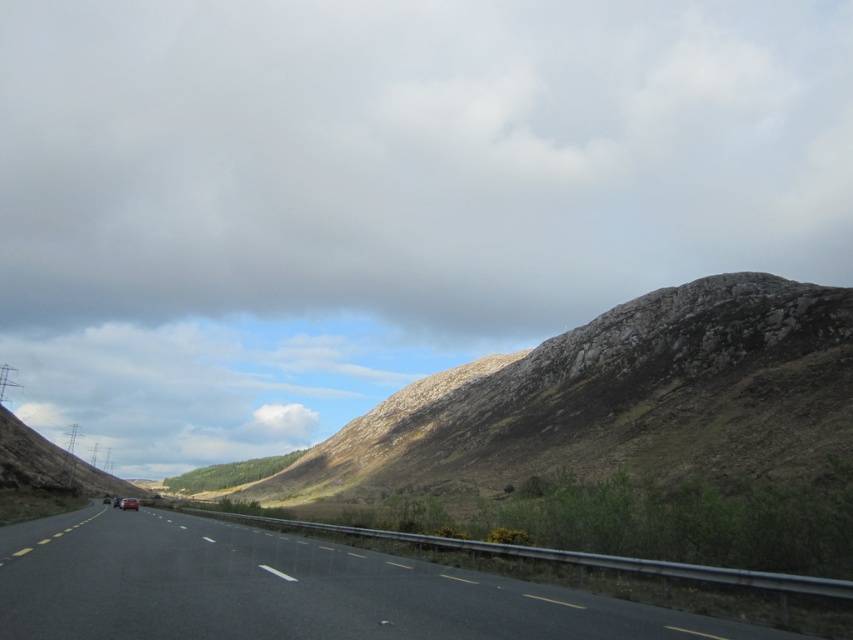
Is cloudy sky at upper center positioned before black asphalt highway at center?

That is False.

Can you confirm if cloudy sky at upper center is wider than black asphalt highway at center?

Yes.

Between point (627, 120) and point (648, 621), which one is positioned behind?

Point (627, 120)

Locate an element on the screen. cloudy sky at upper center is located at coordinates (413, 157).